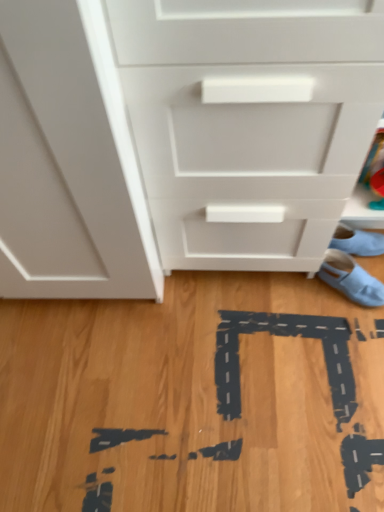
I want to click on free space in front of light blue fabric shoe at lower right, which is counted as the 1th footwear, starting from the bottom, so click(345, 348).